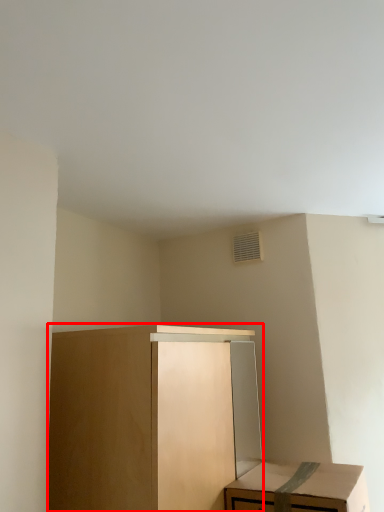
Question: From the image, what is the correct spatial relationship of cabinetry (annotated by the red box) in relation to table?

Choices:
 (A) left
 (B) right

Answer: (A)